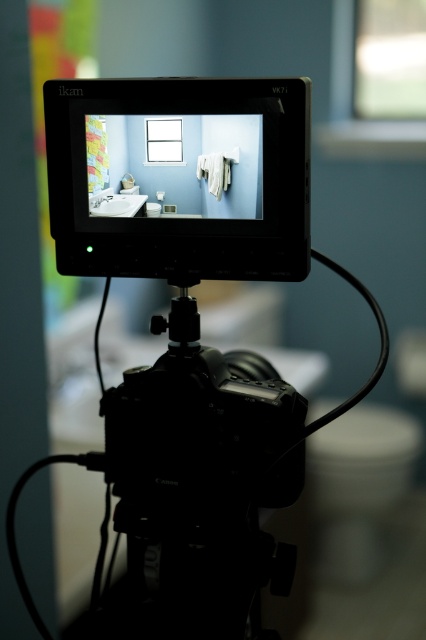
Question: Can you confirm if white glossy toilet bowl at lower right is bigger than white glossy sink at center?

Choices:
 (A) yes
 (B) no

Answer: (A)

Question: Does black matte monitor at center have a lesser width compared to white glossy sink at center?

Choices:
 (A) no
 (B) yes

Answer: (A)

Question: From the image, what is the correct spatial relationship of white glossy toilet bowl at lower right in relation to white glossy sink at center?

Choices:
 (A) right
 (B) left

Answer: (A)

Question: Estimate the real-world distances between objects in this image. Which object is farther from the black matte monitor at center?

Choices:
 (A) white glossy toilet bowl at lower right
 (B) white glossy sink at center
 (C) black plastic tripod at center

Answer: (A)

Question: Estimate the real-world distances between objects in this image. Which object is farther from the white glossy sink at center?

Choices:
 (A) black plastic tripod at center
 (B) white glossy toilet bowl at lower right

Answer: (B)

Question: Which of the following is the closest to the observer?

Choices:
 (A) white glossy sink at center
 (B) black plastic tripod at center

Answer: (B)